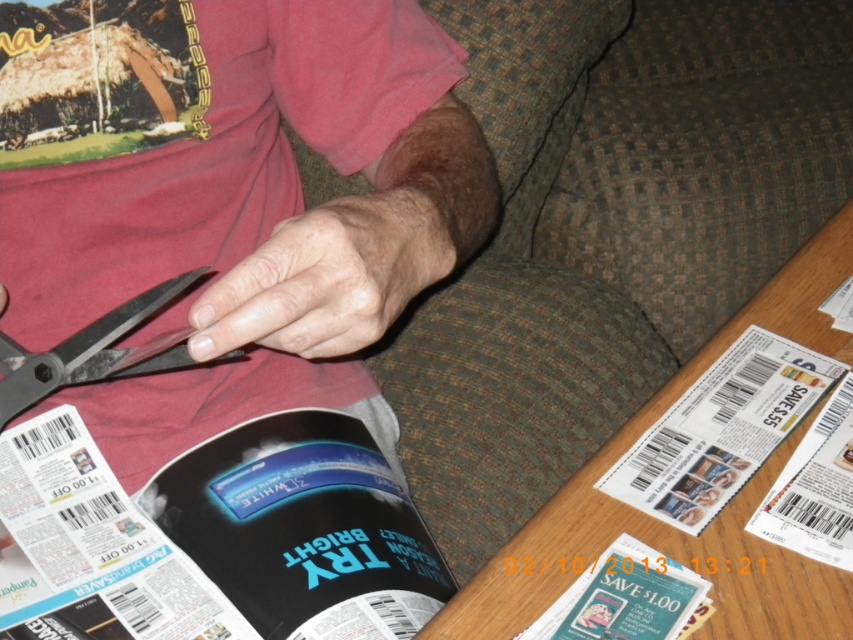
Question: Which object is positioned farthest from the white glossy coupon at lower right?

Choices:
 (A) metallic scissors at upper left
 (B) matte black magazine at lower left
 (C) dry skin at center

Answer: (A)

Question: Which object is farther from the camera taking this photo?

Choices:
 (A) matte black magazine at lower right
 (B) matte black magazine at lower left
 (C) matte black magazine at lower center
 (D) white glossy coupon at lower right

Answer: (B)

Question: Is black matte scissors at left further to camera compared to matte black magazine at lower center?

Choices:
 (A) yes
 (B) no

Answer: (B)

Question: Does metallic scissors at upper left have a greater width compared to dry skin at center?

Choices:
 (A) yes
 (B) no

Answer: (A)

Question: Considering the relative positions of metallic scissors at upper left and white glossy coupon at lower right in the image provided, where is metallic scissors at upper left located with respect to white glossy coupon at lower right?

Choices:
 (A) left
 (B) right

Answer: (A)

Question: Which point is farther from the camera taking this photo?

Choices:
 (A) (234, 518)
 (B) (438, 26)

Answer: (B)